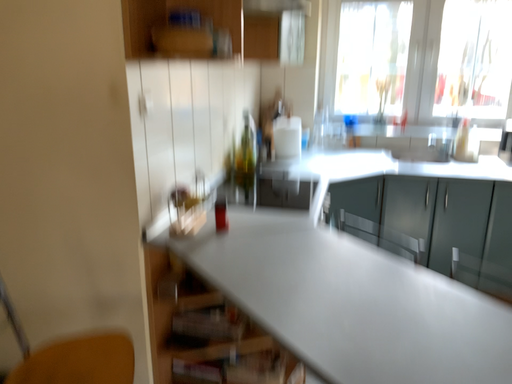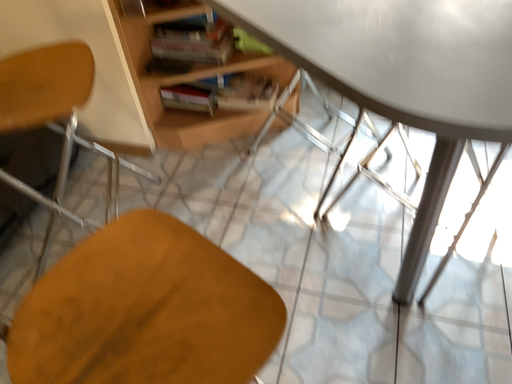
Question: Which way did the camera rotate in the video?

Choices:
 (A) rotated downward
 (B) rotated upward

Answer: (A)